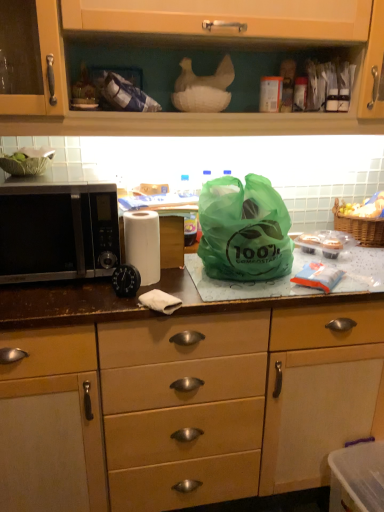
At what (x,y) coordinates should I click in order to perform the action: click on free space to the left of white matte paper towel at center. Please return your answer as a coordinate pair (x, y). The height and width of the screenshot is (512, 384). Looking at the image, I should click on (78, 292).